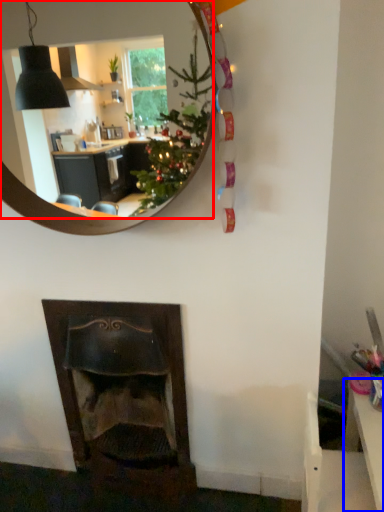
Question: Which object appears closest to the camera in this image, mirror (highlighted by a red box) or table (highlighted by a blue box)?

Choices:
 (A) mirror
 (B) table

Answer: (A)